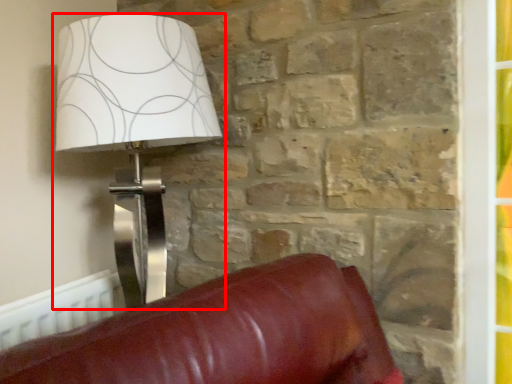
Question: Where is lamp (annotated by the red box) located in relation to radiator in the image?

Choices:
 (A) left
 (B) right

Answer: (B)